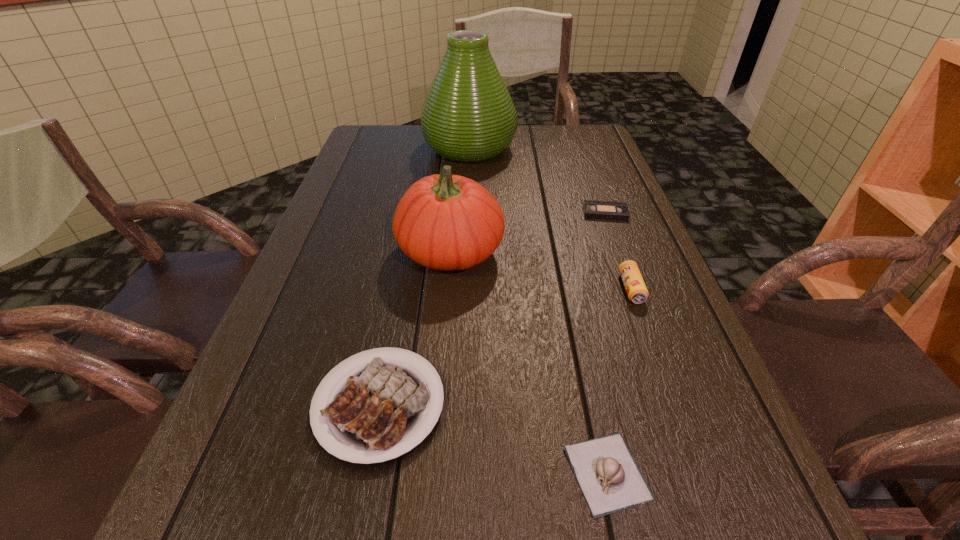
Locate an element on the screen. This screenshot has height=540, width=960. vacant space situated 0.060m on the front of the fourth shortest object is located at coordinates (646, 328).

The height and width of the screenshot is (540, 960). Find the location of `free space located on the right of the plate`. free space located on the right of the plate is located at coordinates (691, 404).

Identify the location of blank space located 0.140m on the left of the fifth tallest object. (468, 472).

Identify the location of vacant space situated on the front of the videotape. (632, 285).

Locate an element on the screen. object that is positioned at the far edge is located at coordinates 468,116.

In order to click on object that is at the left edge in this screenshot , I will do `click(375, 411)`.

Where is `beer can located at the right edge`? beer can located at the right edge is located at coordinates (637, 292).

Locate an element on the screen. garlic present at the right edge is located at coordinates (610, 480).

Identify the location of videotape that is at the right edge. (594, 209).

In the image, there is a desktop. Where is `vacant space at the far edge`? vacant space at the far edge is located at coordinates (524, 137).